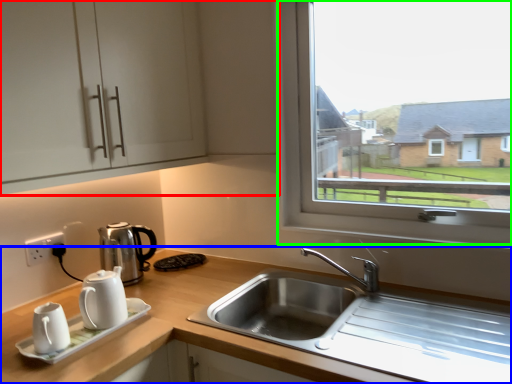
Question: Estimate the real-world distances between objects in this image. Which object is farther from cabinetry (highlighted by a red box), countertop (highlighted by a blue box) or window (highlighted by a green box)?

Choices:
 (A) countertop
 (B) window

Answer: (A)